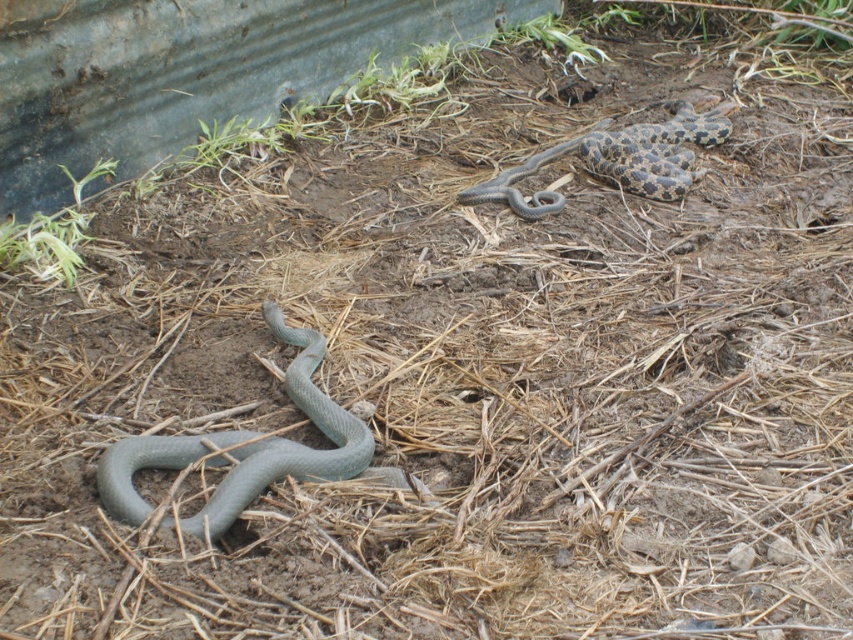
You are a gardener who needs to retrieve a tool located near the matte gray snake at lower left and the speckled gray snake at upper right. Which snake should you approach first to ensure you don

The matte gray snake at lower left is in front of the speckled gray snake at upper right, so you should approach the matte gray snake at lower left first since it is closer to your current position.

You are a gardener looking at the two snakes. Which snake is positioned lower in the image, the matte gray snake at lower left or the speckled gray snake at upper right?

The matte gray snake at lower left is positioned lower in the image than the speckled gray snake at upper right.

You are a wildlife photographer trying to capture both the matte gray snake at lower left and the speckled gray snake at upper right in the same frame. Based on their widths, which snake would you need to position closer to the camera to ensure both appear similarly sized in your photo?

The matte gray snake at lower left has a lesser width compared to the speckled gray snake at upper right. To make them appear similarly sized in the photo, you should position the matte gray snake at lower left closer to the camera since it is narrower and needs to be magnified more to match the width of the speckled gray snake at upper right.